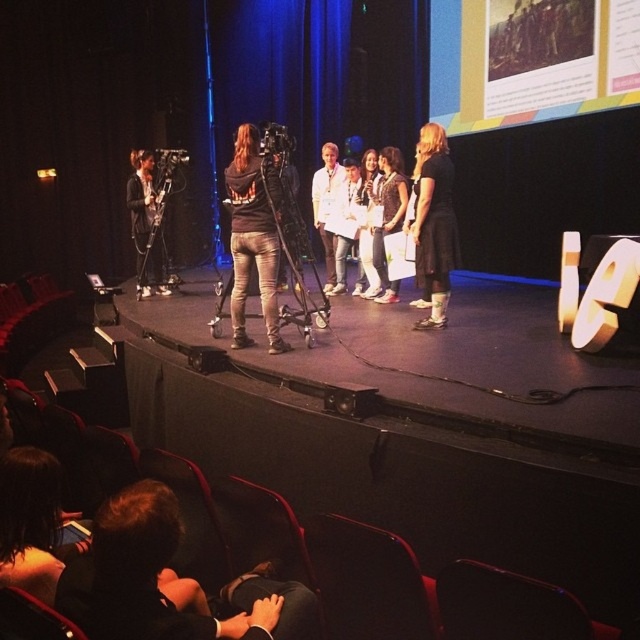
Question: Is black leather jacket at center positioned in front of black matte dress at center?

Choices:
 (A) no
 (B) yes

Answer: (B)

Question: Can you confirm if black matte dress at center is smaller than white cotton dress at center?

Choices:
 (A) yes
 (B) no

Answer: (A)

Question: Is black leather jacket at center positioned behind white matte shirt at center?

Choices:
 (A) yes
 (B) no

Answer: (B)

Question: Based on their relative distances, which object is farther from the white cotton dress at center?

Choices:
 (A) black leather jacket at center
 (B) black matte dress at center
 (C) white matte shirt at center
 (D) matte black dress at center

Answer: (A)

Question: Which point is farther to the camera?

Choices:
 (A) (273, 228)
 (B) (397, 164)
 (C) (376, 291)
 (D) (333, 240)

Answer: (D)

Question: Which point is farther to the camera?

Choices:
 (A) (387, 296)
 (B) (364, 216)
 (C) (432, 214)

Answer: (B)